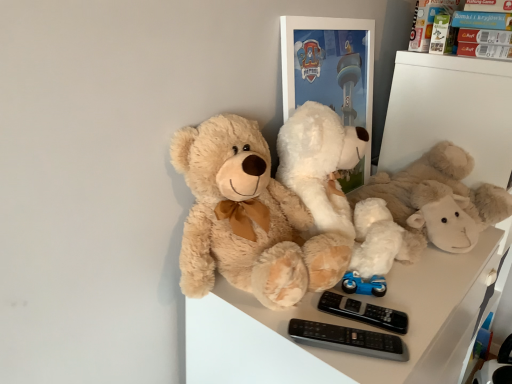
Question: Is black plastic remote controls at lower center in contact with matte cardboard box at upper right?

Choices:
 (A) yes
 (B) no

Answer: (B)

Question: Can you confirm if black plastic remote controls at lower center is wider than matte cardboard box at upper right?

Choices:
 (A) no
 (B) yes

Answer: (B)

Question: Does black plastic remote controls at lower center have a smaller size compared to matte cardboard box at upper right?

Choices:
 (A) no
 (B) yes

Answer: (B)

Question: Is black plastic remote controls at lower center thinner than matte cardboard box at upper right?

Choices:
 (A) yes
 (B) no

Answer: (B)

Question: From the image's perspective, is black plastic remote controls at lower center located beneath matte cardboard box at upper right?

Choices:
 (A) no
 (B) yes

Answer: (B)

Question: Relative to black plastic remote controls at lower center, is fluffy beige teddy bear at center, positioned as the second teddy bear in right-to-left order, in front or behind?

Choices:
 (A) front
 (B) behind

Answer: (A)

Question: From a real-world perspective, relative to black plastic remote controls at lower center, is fluffy beige teddy bear at center, the first teddy bear in the left-to-right sequence, vertically above or below?

Choices:
 (A) below
 (B) above

Answer: (B)

Question: Which is correct: fluffy beige teddy bear at center, positioned as the second teddy bear in right-to-left order, is inside black plastic remote controls at lower center, or outside of it?

Choices:
 (A) inside
 (B) outside

Answer: (B)

Question: Is point (204, 269) closer or farther from the camera than point (334, 344)?

Choices:
 (A) farther
 (B) closer

Answer: (A)

Question: Considering the positions of fluffy beige teddy bear at center, positioned as the second teddy bear in right-to-left order, and matte cardboard box at upper right in the image, is fluffy beige teddy bear at center, positioned as the second teddy bear in right-to-left order, wider or thinner than matte cardboard box at upper right?

Choices:
 (A) wide
 (B) thin

Answer: (A)

Question: Is fluffy beige teddy bear at center, the first teddy bear in the left-to-right sequence, inside the boundaries of matte cardboard box at upper right, or outside?

Choices:
 (A) inside
 (B) outside

Answer: (B)

Question: Is point (283, 309) positioned closer to the camera than point (497, 13)?

Choices:
 (A) farther
 (B) closer

Answer: (B)

Question: From their relative heights in the image, would you say fluffy beige teddy bear at center, positioned as the second teddy bear in right-to-left order, is taller or shorter than matte cardboard box at upper right?

Choices:
 (A) tall
 (B) short

Answer: (A)

Question: Considering the positions of white plush toy at center, which appears as the first teddy bear when viewed from the right, and fluffy beige teddy bear at center, positioned as the second teddy bear in right-to-left order, in the image, is white plush toy at center, which appears as the first teddy bear when viewed from the right, wider or thinner than fluffy beige teddy bear at center, positioned as the second teddy bear in right-to-left order,?

Choices:
 (A) thin
 (B) wide

Answer: (B)

Question: Considering the positions of white plush toy at center, which appears as the second teddy bear when viewed from the left, and fluffy beige teddy bear at center, positioned as the second teddy bear in right-to-left order, in the image, is white plush toy at center, which appears as the second teddy bear when viewed from the left, taller or shorter than fluffy beige teddy bear at center, positioned as the second teddy bear in right-to-left order,?

Choices:
 (A) tall
 (B) short

Answer: (B)